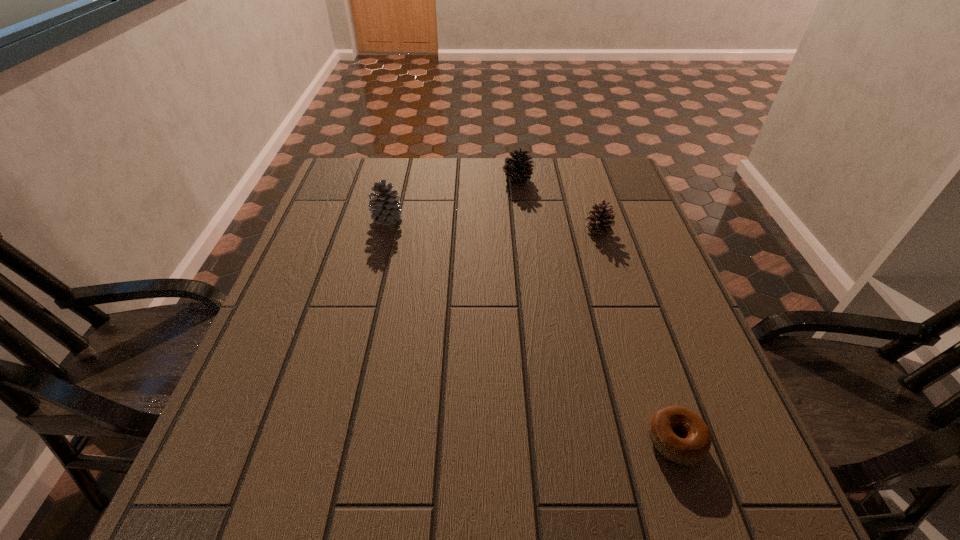
I want to click on the tallest pinecone, so click(384, 206).

Find the location of `the leftmost pinecone`. the leftmost pinecone is located at coordinates (384, 206).

Locate an element on the screen. The image size is (960, 540). the second pinecone from left to right is located at coordinates (518, 168).

The image size is (960, 540). Identify the location of the second tallest object. (518, 168).

This screenshot has width=960, height=540. Find the location of `the second shortest object`. the second shortest object is located at coordinates (599, 222).

Identify the location of the rightmost pinecone. The image size is (960, 540). point(599,222).

Find the location of `the nearest object`. the nearest object is located at coordinates (692, 448).

Locate an element on the screen. This screenshot has width=960, height=540. bagel is located at coordinates tap(692, 448).

Locate an element on the screen. The height and width of the screenshot is (540, 960). vacant space situated on the front of the leftmost pinecone is located at coordinates (380, 246).

This screenshot has height=540, width=960. In order to click on free region located on the right of the farthest pinecone in this screenshot , I will do `click(552, 179)`.